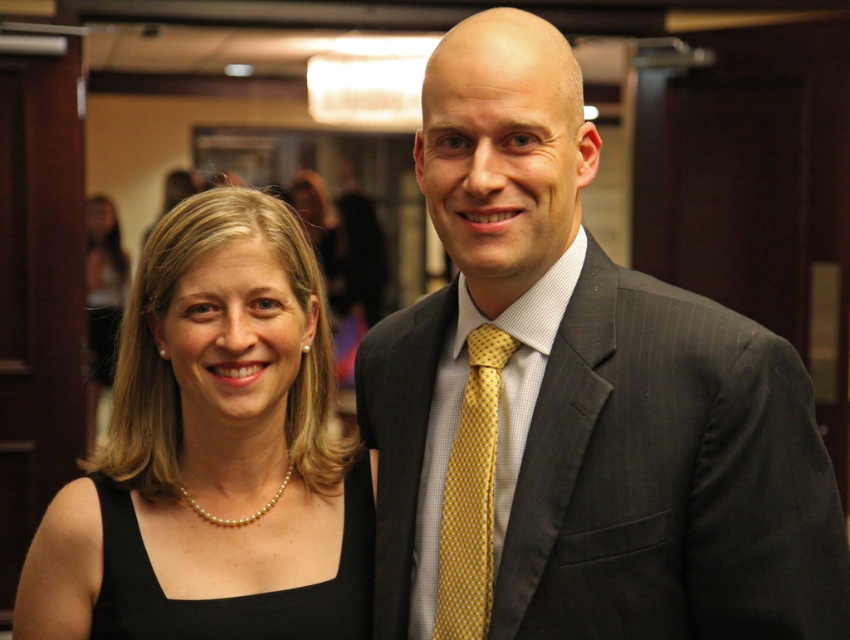
Does black pearl necklace at lower left lie behind yellow dotted tie at center?

Yes, it is behind yellow dotted tie at center.

Which of these two, black pearl necklace at lower left or yellow dotted tie at center, stands shorter?

black pearl necklace at lower left is shorter.

Does point (352, 540) lie behind point (462, 477)?

Yes, point (352, 540) is farther from viewer.

Identify the location of black pearl necklace at lower left. The height and width of the screenshot is (640, 850). (239, 595).

Does black satin dress at center appear on the left side of yellow dotted tie at center?

Correct, you'll find black satin dress at center to the left of yellow dotted tie at center.

Which is below, black satin dress at center or yellow dotted tie at center?

yellow dotted tie at center

You are a GUI agent. You are given a task and a screenshot of the screen. Output one action in this format:
    pyautogui.click(x=<x>, y=<y>)
    Task: Click on the black satin dress at center
    
    Given the screenshot: What is the action you would take?
    pyautogui.click(x=213, y=452)

I want to click on black satin dress at center, so click(x=213, y=452).

Is black satin dress at center in front of black pearl necklace at lower left?

No, black satin dress at center is further to the viewer.

Which of these two, black satin dress at center or black pearl necklace at lower left, stands taller?

black satin dress at center is taller.

Which is behind, point (268, 356) or point (132, 509)?

The point (132, 509) is more distant.

Find the location of a particular element. The image size is (850, 640). black satin dress at center is located at coordinates pos(213,452).